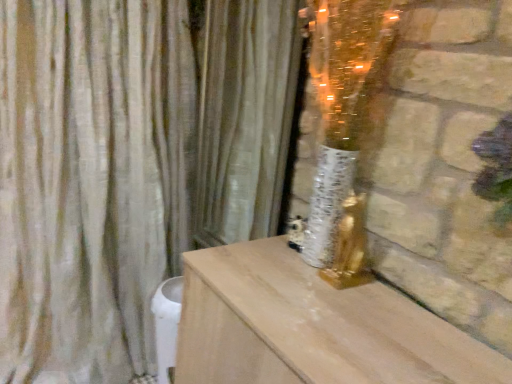
Question: Is beige fabric curtain at left, the first curtain viewed from the left, at the right side of silky beige curtain at center, placed as the second curtain when sorted from left to right?

Choices:
 (A) no
 (B) yes

Answer: (A)

Question: Can you confirm if beige fabric curtain at left, the first curtain viewed from the left, is wider than silky beige curtain at center, which is counted as the 1th curtain, starting from the right?

Choices:
 (A) no
 (B) yes

Answer: (B)

Question: Is beige fabric curtain at left, which appears as the second curtain when viewed from the right, to the left of silky beige curtain at center, placed as the second curtain when sorted from left to right, from the viewer's perspective?

Choices:
 (A) no
 (B) yes

Answer: (B)

Question: Can you confirm if beige fabric curtain at left, which appears as the second curtain when viewed from the right, is bigger than silky beige curtain at center, which is counted as the 1th curtain, starting from the right?

Choices:
 (A) yes
 (B) no

Answer: (A)

Question: Is the surface of beige fabric curtain at left, which appears as the second curtain when viewed from the right, in direct contact with silky beige curtain at center, placed as the second curtain when sorted from left to right?

Choices:
 (A) no
 (B) yes

Answer: (A)

Question: Is beige fabric curtain at left, which appears as the second curtain when viewed from the right, positioned behind silky beige curtain at center, placed as the second curtain when sorted from left to right?

Choices:
 (A) yes
 (B) no

Answer: (B)

Question: Can you confirm if silky beige curtain at center, which is counted as the 1th curtain, starting from the right, is smaller than beige fabric curtain at left, the first curtain viewed from the left?

Choices:
 (A) no
 (B) yes

Answer: (B)

Question: Can you confirm if silky beige curtain at center, which is counted as the 1th curtain, starting from the right, is thinner than beige fabric curtain at left, which appears as the second curtain when viewed from the right?

Choices:
 (A) no
 (B) yes

Answer: (B)

Question: Considering the relative sizes of silky beige curtain at center, placed as the second curtain when sorted from left to right, and beige fabric curtain at left, which appears as the second curtain when viewed from the right, in the image provided, is silky beige curtain at center, placed as the second curtain when sorted from left to right, taller than beige fabric curtain at left, which appears as the second curtain when viewed from the right,?

Choices:
 (A) yes
 (B) no

Answer: (B)

Question: From a real-world perspective, is silky beige curtain at center, which is counted as the 1th curtain, starting from the right, under beige fabric curtain at left, the first curtain viewed from the left?

Choices:
 (A) yes
 (B) no

Answer: (B)

Question: Is the position of silky beige curtain at center, placed as the second curtain when sorted from left to right, less distant than that of beige fabric curtain at left, which appears as the second curtain when viewed from the right?

Choices:
 (A) yes
 (B) no

Answer: (B)

Question: Is silky beige curtain at center, which is counted as the 1th curtain, starting from the right, turned away from beige fabric curtain at left, which appears as the second curtain when viewed from the right?

Choices:
 (A) no
 (B) yes

Answer: (A)

Question: From the image's perspective, relative to beige fabric curtain at left, which appears as the second curtain when viewed from the right, is silky beige curtain at center, which is counted as the 1th curtain, starting from the right, above or below?

Choices:
 (A) above
 (B) below

Answer: (A)